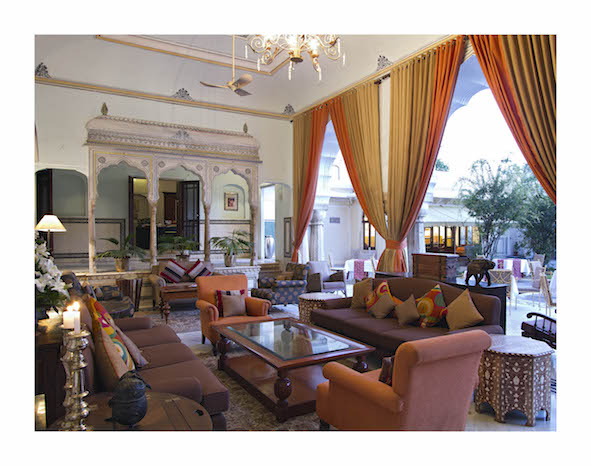
You are a GUI agent. You are given a task and a screenshot of the screen. Output one action in this format:
    pyautogui.click(x=<x>, y=<y>)
    Task: Click on the lampshade
    The image size is (591, 466).
    Given the screenshot: What is the action you would take?
    pyautogui.click(x=48, y=223)